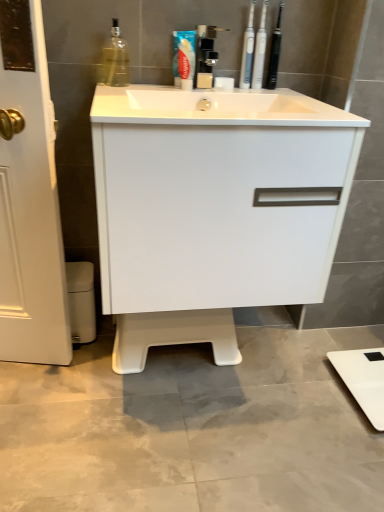
Locate an element on the screen. vacant space to the right of translucent glass bottle at upper left is located at coordinates (154, 88).